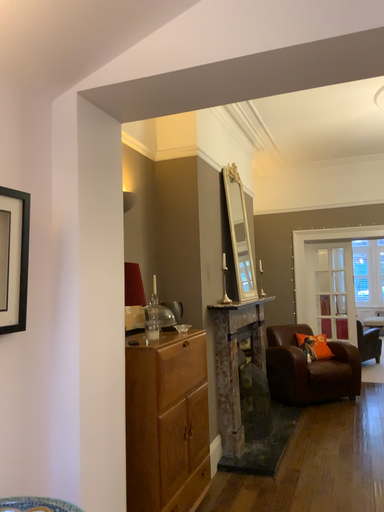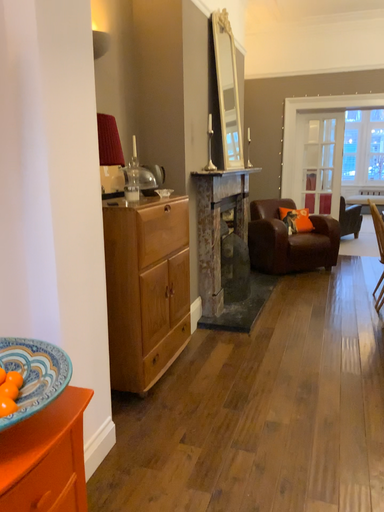
Question: How did the camera likely rotate when shooting the video?

Choices:
 (A) rotated upward
 (B) rotated downward

Answer: (B)